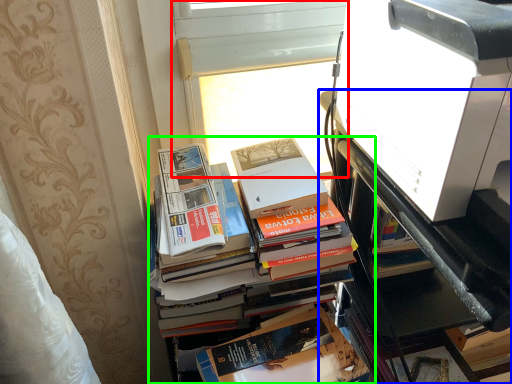
Question: Which object is positioned farthest from window screen (highlighted by a red box)? Select from bookcase (highlighted by a blue box) and book (highlighted by a green box).

Choices:
 (A) bookcase
 (B) book

Answer: (A)